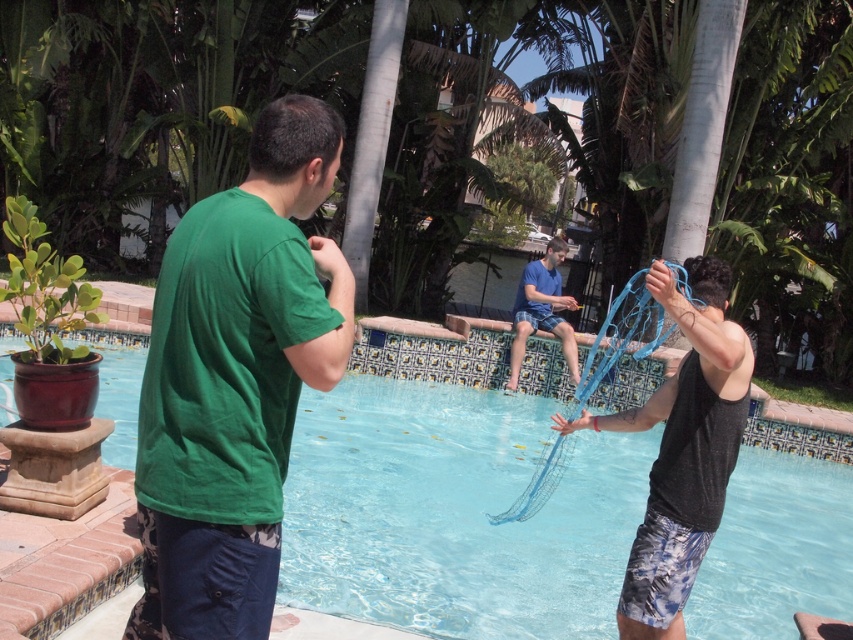
Which is more to the left, transparent blue water at center or green matte shirt at center?

green matte shirt at center

Is point (585, 470) less distant than point (323, 355)?

That is False.

Locate an element on the screen. transparent blue water at center is located at coordinates [x=453, y=513].

Identify the location of transparent blue water at center. Image resolution: width=853 pixels, height=640 pixels. (453, 513).

Who is positioned more to the right, transparent blue water at center or blue fabric net at upper center?

Positioned to the right is blue fabric net at upper center.

Between point (103, 412) and point (531, 308), which one is positioned behind?

The point (531, 308) is behind.

The image size is (853, 640). What are the coordinates of `transparent blue water at center` in the screenshot? It's located at (453, 513).

Between green matte shirt at center and blue fabric net at upper center, which one is positioned higher?

Positioned higher is blue fabric net at upper center.

Is green matte shirt at center positioned behind blue fabric net at upper center?

No, green matte shirt at center is in front of blue fabric net at upper center.

Describe the element at coordinates (235, 380) in the screenshot. I see `green matte shirt at center` at that location.

Locate an element on the screen. green matte shirt at center is located at coordinates (235, 380).